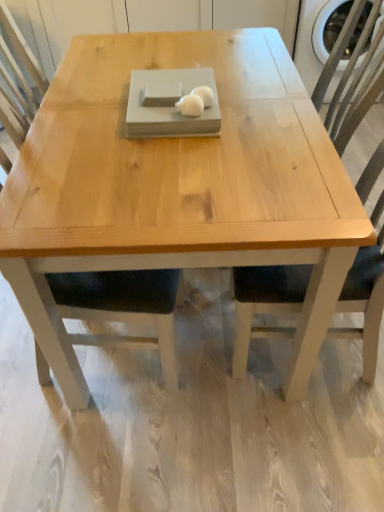
This screenshot has width=384, height=512. What are the coordinates of `free space that is to the left of natural wood chair at right` in the screenshot? It's located at (179, 373).